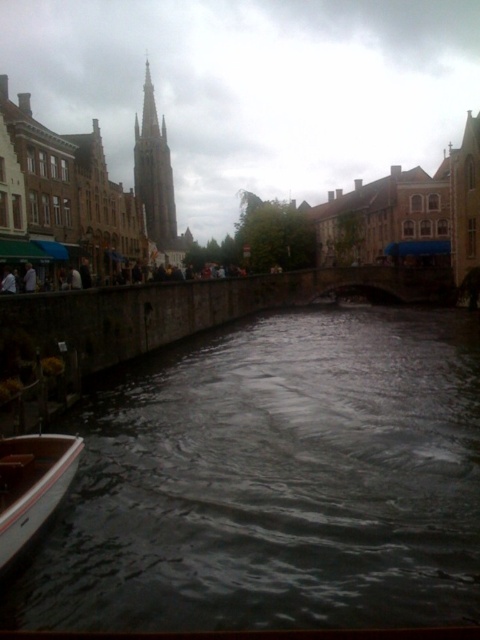
Is point (272, 579) farther from camera compared to point (167, 230)?

No, (272, 579) is closer to viewer.

Is point (74, 572) less distant than point (156, 173)?

That is True.

At what (x,y) coordinates should I click in order to perform the action: click on dark gray water at lower center. Please return your answer as a coordinate pair (x, y). Looking at the image, I should click on (273, 483).

Who is more forward, (16, 502) or (162, 192)?

Point (16, 502) is more forward.

Is white wood boat at lower left taller than brown stone tower at center?

No.

Locate an element on the screen. This screenshot has height=640, width=480. white wood boat at lower left is located at coordinates (32, 484).

Is dark gray water at lower center positioned before white wood boat at lower left?

Yes.

Does dark gray water at lower center have a lesser width compared to white wood boat at lower left?

Incorrect, dark gray water at lower center's width is not less than white wood boat at lower left's.

Is point (272, 392) positioned in front of point (20, 536)?

No, (272, 392) is further to viewer.

Where is `dark gray water at lower center`? The image size is (480, 640). dark gray water at lower center is located at coordinates (273, 483).